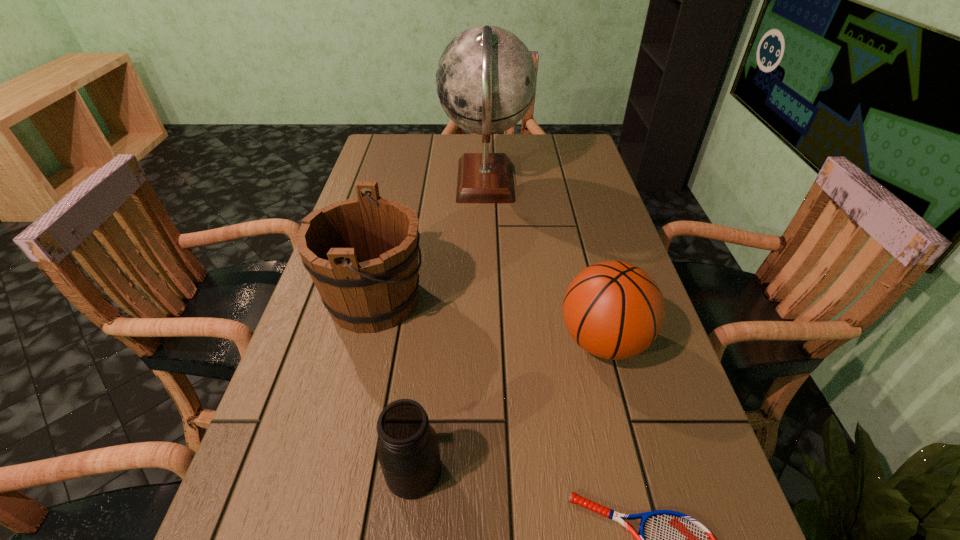
Where is `vacant position located 0.200m on the back of the second shortest object`? This screenshot has width=960, height=540. vacant position located 0.200m on the back of the second shortest object is located at coordinates (426, 352).

You are a GUI agent. You are given a task and a screenshot of the screen. Output one action in this format:
    pyautogui.click(x=<x>, y=<y>)
    Task: Click on the object at the far edge
    Image resolution: width=960 pixels, height=540 pixels.
    Given the screenshot: What is the action you would take?
    pyautogui.click(x=486, y=79)

Identify the location of object that is at the left edge. (362, 253).

Identify the location of object located at the right edge. The image size is (960, 540). (614, 310).

The image size is (960, 540). I want to click on free spot at the far edge of the desktop, so click(x=519, y=156).

At what (x,y) coordinates should I click in order to perform the action: click on blank space at the left edge of the desktop. Please return your answer as a coordinate pair (x, y). The height and width of the screenshot is (540, 960). Looking at the image, I should click on (326, 421).

Locate an element on the screen. The width and height of the screenshot is (960, 540). vacant region at the right edge is located at coordinates pos(669,509).

Find the location of a particular element. This screenshot has height=540, width=960. free space at the far right corner is located at coordinates (586, 166).

You are a GUI agent. You are given a task and a screenshot of the screen. Output one action in this format:
    pyautogui.click(x=<x>, y=<y>)
    Task: Click on the free area in between the fourth shortest object and the third tallest object
    
    Given the screenshot: What is the action you would take?
    pyautogui.click(x=489, y=321)

The height and width of the screenshot is (540, 960). What are the coordinates of `free space between the fourth shortest object and the third tallest object` in the screenshot? It's located at (489, 321).